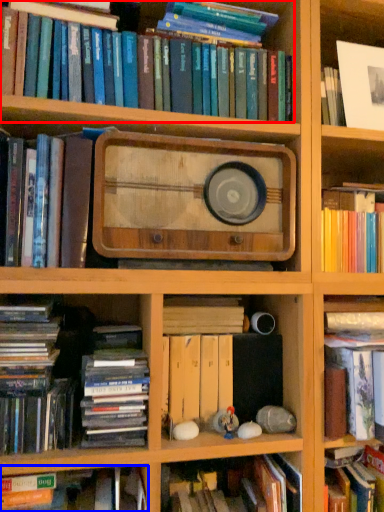
Question: Which object appears farthest to the camera in this image, book (highlighted by a red box) or book (highlighted by a blue box)?

Choices:
 (A) book
 (B) book

Answer: (A)